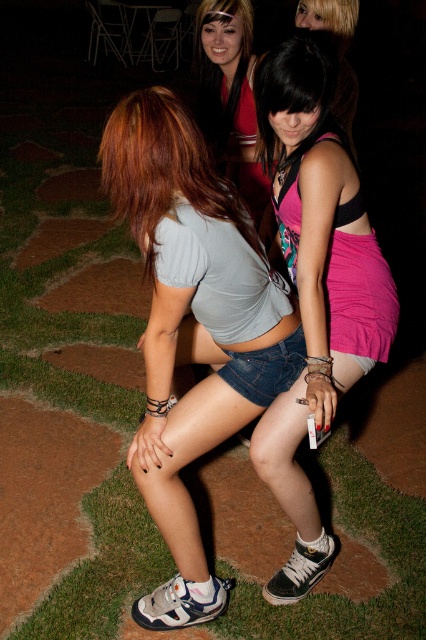
Question: Does pink matte tank top at center lie behind matte red dress at upper center?

Choices:
 (A) no
 (B) yes

Answer: (A)

Question: Based on their relative distances, which object is farther from the matte gray shirt at center?

Choices:
 (A) pink matte tank top at center
 (B) matte red dress at upper center

Answer: (B)

Question: Does pink matte tank top at center have a larger size compared to matte red dress at upper center?

Choices:
 (A) no
 (B) yes

Answer: (B)

Question: Is matte gray shirt at center thinner than matte red dress at upper center?

Choices:
 (A) no
 (B) yes

Answer: (A)

Question: Which point appears farthest from the camera in this image?

Choices:
 (A) (331, 72)
 (B) (170, 304)

Answer: (A)

Question: Based on their relative distances, which object is farther from the matte gray shirt at center?

Choices:
 (A) matte red dress at upper center
 (B) pink matte tank top at center

Answer: (A)